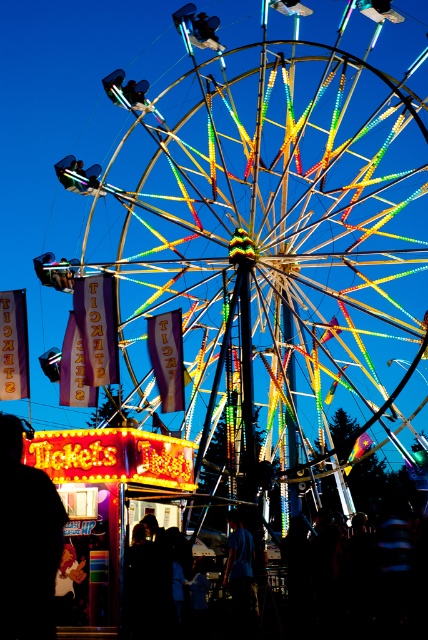
What do you see at coordinates (240, 566) in the screenshot?
I see `blue fabric shirt at center` at bounding box center [240, 566].

At what (x,y) coordinates should I click in order to perform the action: click on blue fabric shirt at center. Please return your answer as a coordinate pair (x, y). This screenshot has height=640, width=428. Looking at the image, I should click on tap(240, 566).

At what (x,y) coordinates should I click in order to perform the action: click on blue fabric shirt at center. Please return your answer as a coordinate pair (x, y). Looking at the image, I should click on (240, 566).

Is silhouette figure at lower left positioned before blue fabric shirt at center?

Yes, silhouette figure at lower left is closer to the viewer.

Measure the distance from silhouette figure at lower left to blue fabric shirt at center.

92.26 feet

Does point (59, 504) come farther from viewer compared to point (237, 556)?

That is False.

Identify the location of silhouette figure at lower left. This screenshot has height=640, width=428. (26, 540).

Can you confirm if silhouette figure at lower left is positioned below matte black figure at lower left?

Actually, silhouette figure at lower left is above matte black figure at lower left.

Who is positioned more to the left, silhouette figure at lower left or matte black figure at lower left?

Positioned to the left is silhouette figure at lower left.

Which is behind, point (35, 612) or point (59, 572)?

The point (59, 572) is behind.

Locate an element on the screen. The height and width of the screenshot is (640, 428). silhouette figure at lower left is located at coordinates (26, 540).